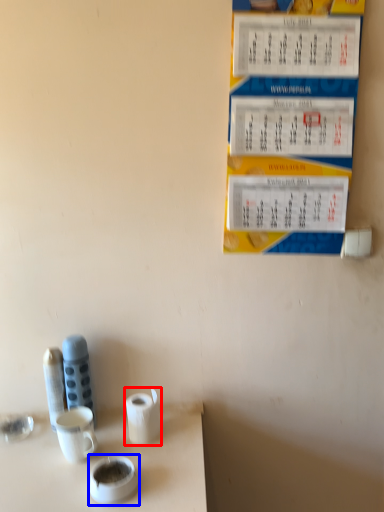
Question: Which of the following is the closest to the observer, toilet paper (highlighted by a red box) or teacup (highlighted by a blue box)?

Choices:
 (A) toilet paper
 (B) teacup

Answer: (B)